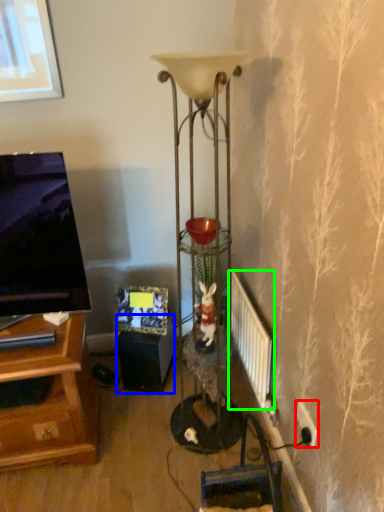
Question: Based on their relative distances, which object is nearer to electric outlet (highlighted by a red box)? Choose from speaker (highlighted by a blue box) and radiator (highlighted by a green box).

Choices:
 (A) speaker
 (B) radiator

Answer: (B)